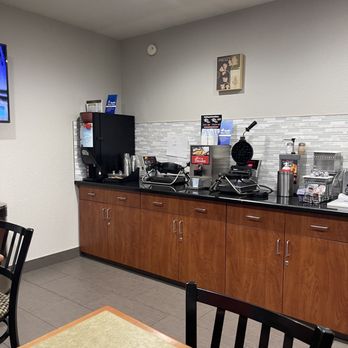
Where is `tiled floor`? This screenshot has width=348, height=348. tiled floor is located at coordinates (71, 288).